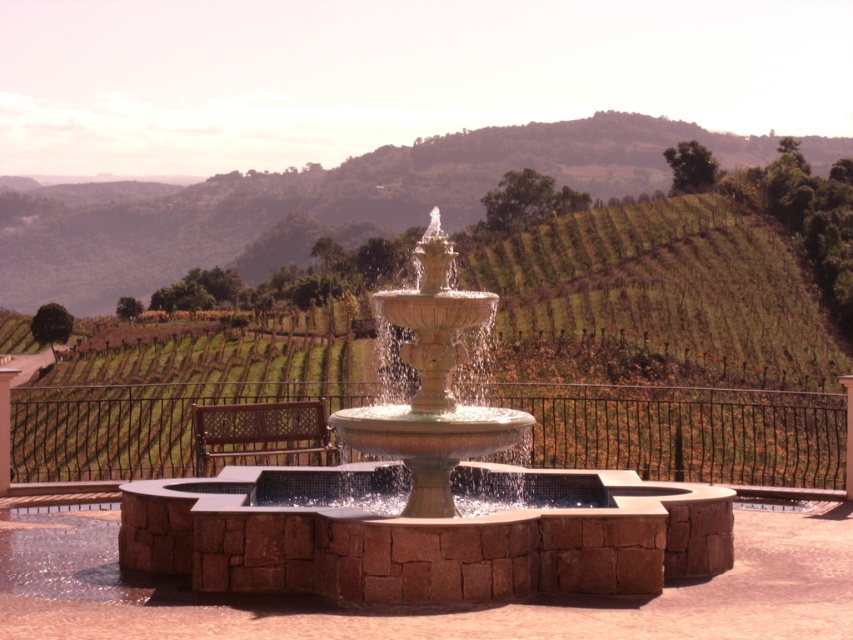
Who is positioned more to the right, stone fountain at center or green grassy hillside at upper center?

Positioned to the right is stone fountain at center.

Which is above, stone fountain at center or green grassy hillside at upper center?

green grassy hillside at upper center is above.

Is point (167, 516) positioned before point (352, 227)?

Yes.

This screenshot has height=640, width=853. In order to click on stone fountain at center in this screenshot , I will do `click(425, 499)`.

Is stone fountain at center taller than beige stone fountain at center?

No, stone fountain at center is not taller than beige stone fountain at center.

What do you see at coordinates (425, 499) in the screenshot? The width and height of the screenshot is (853, 640). I see `stone fountain at center` at bounding box center [425, 499].

Is point (567, 556) farther from viewer compared to point (416, 364)?

No, (567, 556) is in front of (416, 364).

Locate an element on the screen. stone fountain at center is located at coordinates (425, 499).

Between green grassy hillside at upper center and beige stone fountain at center, which one has more height?

green grassy hillside at upper center is taller.

Image resolution: width=853 pixels, height=640 pixels. I want to click on green grassy hillside at upper center, so [x=312, y=204].